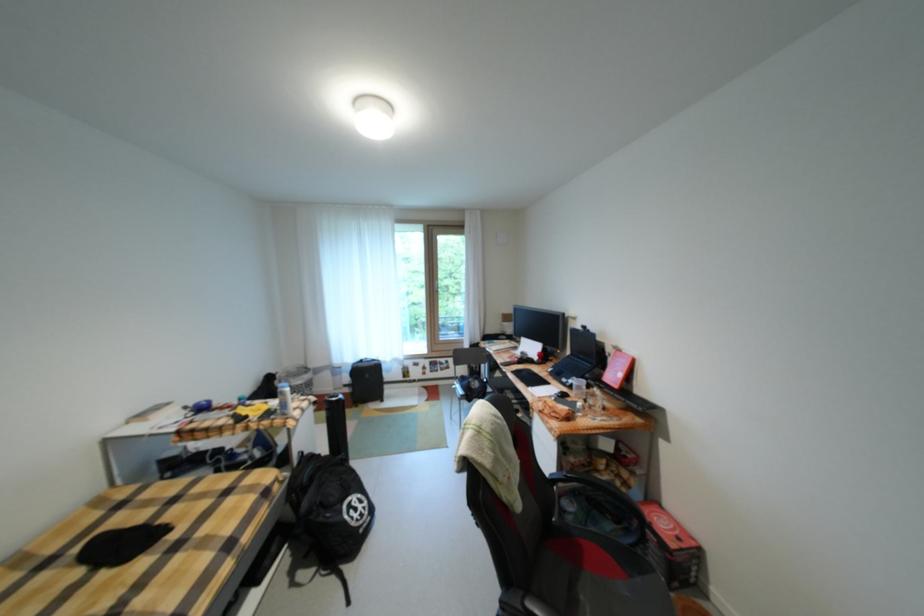
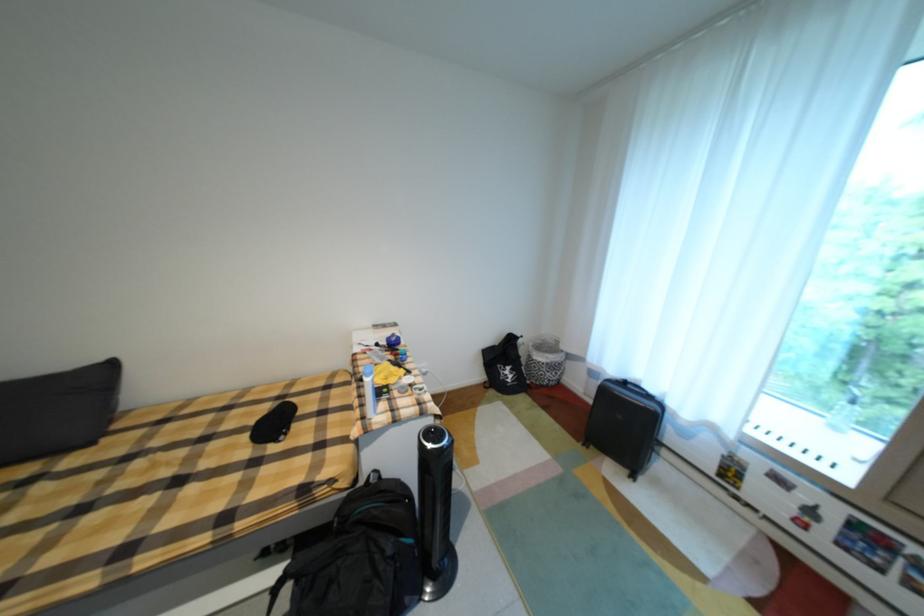
Locate, in the second image, the point that corresponds to [114,576] in the first image.

(256, 438)